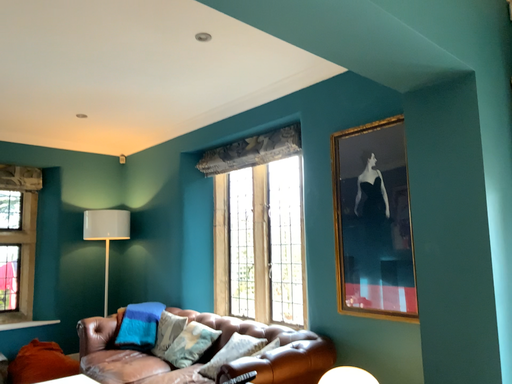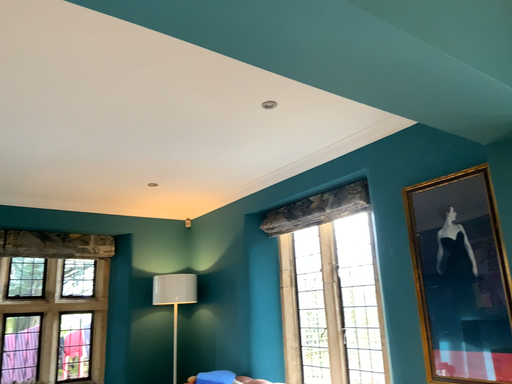
Question: How did the camera likely rotate when shooting the video?

Choices:
 (A) rotated upward
 (B) rotated downward

Answer: (A)